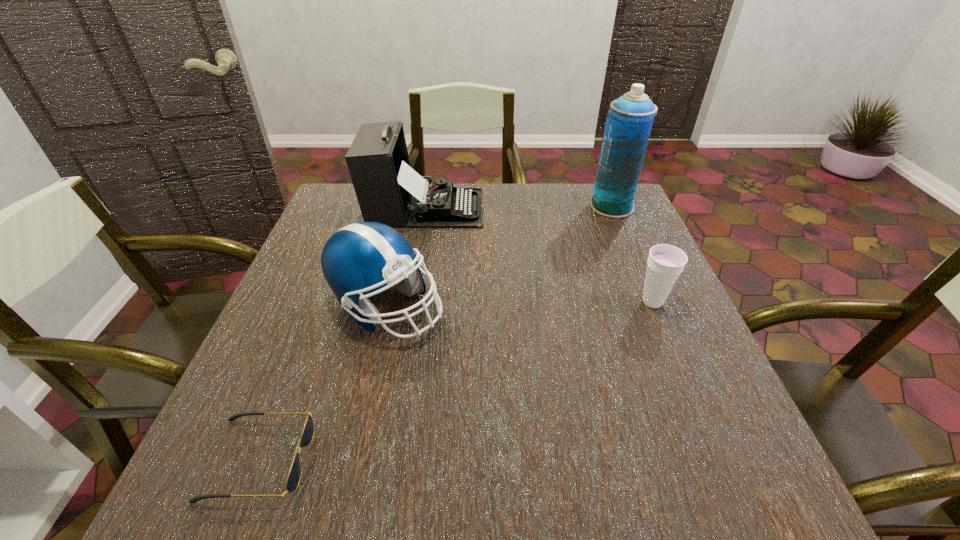
The width and height of the screenshot is (960, 540). In order to click on free space located on the front-facing side of the shortest object in this screenshot , I will do `click(532, 460)`.

The image size is (960, 540). Identify the location of aerosol can that is at the far edge. (629, 120).

Locate an element on the screen. Image resolution: width=960 pixels, height=540 pixels. typewriter that is at the far edge is located at coordinates coord(388,190).

I want to click on object situated at the near edge, so click(x=293, y=479).

Locate an element on the screen. typewriter at the left edge is located at coordinates (388, 190).

Image resolution: width=960 pixels, height=540 pixels. I want to click on football helmet that is at the left edge, so click(360, 258).

Where is `sunglasses located in the left edge section of the desktop`? This screenshot has height=540, width=960. sunglasses located in the left edge section of the desktop is located at coordinates (293, 479).

You are a GUI agent. You are given a task and a screenshot of the screen. Output one action in this format:
    pyautogui.click(x=<x>, y=<y>)
    Task: Click on the aerosol can that is at the right edge
    The width and height of the screenshot is (960, 540).
    Given the screenshot: What is the action you would take?
    pyautogui.click(x=629, y=120)

At what (x,y) coordinates should I click in order to perform the action: click on cup located at the right edge. Please return your answer as a coordinate pair (x, y). Looking at the image, I should click on (665, 263).

Find the location of `object that is positioned at the far left corner`. object that is positioned at the far left corner is located at coordinates (388, 190).